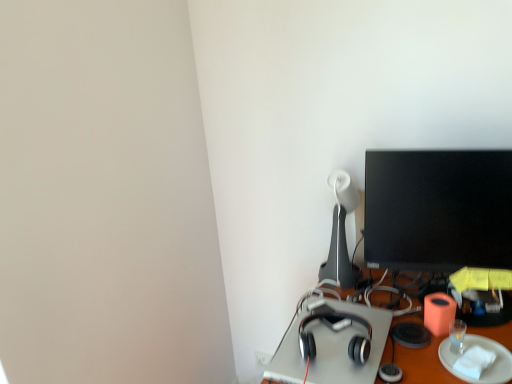
Where is `free point below satin silver headphones at center-right (from a real-world perspective)`? Image resolution: width=512 pixels, height=384 pixels. free point below satin silver headphones at center-right (from a real-world perspective) is located at coordinates (333, 344).